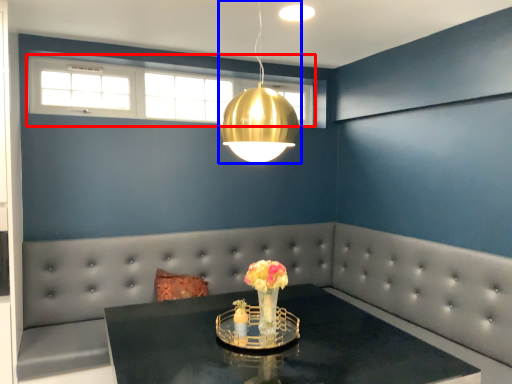
Question: Which object is closer to the camera taking this photo, window (highlighted by a red box) or lamp (highlighted by a blue box)?

Choices:
 (A) window
 (B) lamp

Answer: (B)